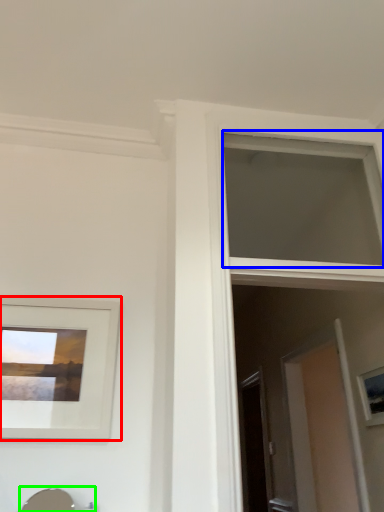
Question: Which is farther away from picture frame (highlighted by a red box)? window (highlighted by a blue box) or sink (highlighted by a green box)?

Choices:
 (A) window
 (B) sink

Answer: (A)